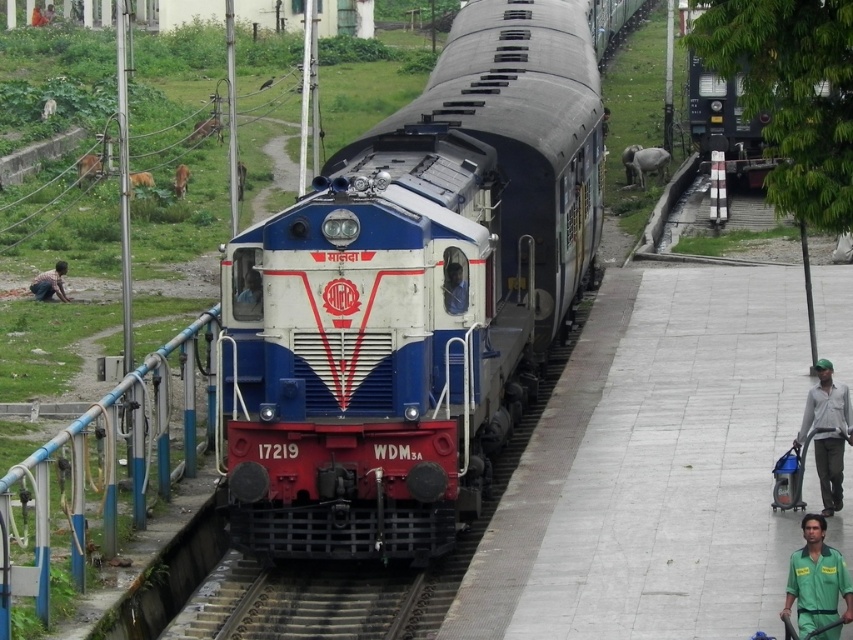
You are a worker on the train platform and need to locate your metallic helmet. According to the image, where is the metallic helmet at center located?

The metallic helmet at center is located at point coordinates of [250,289].

You are standing on the platform and want to take a photo of the blue metallic train at center and the brown skin person at lower left. Which object should you focus on first to ensure both are in the frame?

You should focus on the blue metallic train at center first because it is closer to the viewer than the brown skin person at lower left, so adjusting the focus starting from the closer object ensures both are in the frame.

You are a photographer standing on the platform. You want to take a photo of the blue metallic train at center and the brown skin person at lower left. Which subject will appear wider in the photo?

The blue metallic train at center will appear wider in the photo because its width is larger than the brown skin person at lower left.